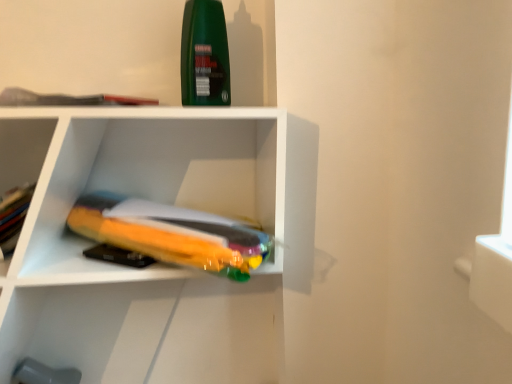
Question: From a real-world perspective, is translucent orange book at center, which appears as the second book when viewed from the top, positioned over matte gray book at upper left, which is the 2th book in bottom-to-top order, based on gravity?

Choices:
 (A) no
 (B) yes

Answer: (A)

Question: Is translucent orange book at center, marked as the first book in a bottom-to-top arrangement, in contact with matte gray book at upper left, which is the 2th book in bottom-to-top order?

Choices:
 (A) no
 (B) yes

Answer: (A)

Question: Is there a large distance between translucent orange book at center, marked as the first book in a bottom-to-top arrangement, and matte gray book at upper left, arranged as the 1th book when viewed from the top?

Choices:
 (A) yes
 (B) no

Answer: (B)

Question: From a real-world perspective, is translucent orange book at center, which appears as the second book when viewed from the top, beneath matte gray book at upper left, which is the 2th book in bottom-to-top order?

Choices:
 (A) yes
 (B) no

Answer: (A)

Question: Considering the relative sizes of translucent orange book at center, which appears as the second book when viewed from the top, and matte gray book at upper left, which is the 2th book in bottom-to-top order, in the image provided, is translucent orange book at center, which appears as the second book when viewed from the top, bigger than matte gray book at upper left, which is the 2th book in bottom-to-top order,?

Choices:
 (A) no
 (B) yes

Answer: (B)

Question: Considering their positions, is green matte bottle at upper center located in front of or behind matte gray book at upper left, arranged as the 1th book when viewed from the top?

Choices:
 (A) front
 (B) behind

Answer: (B)

Question: Based on their positions, is green matte bottle at upper center located to the left or right of matte gray book at upper left, which is the 2th book in bottom-to-top order?

Choices:
 (A) left
 (B) right

Answer: (B)

Question: In terms of height, does green matte bottle at upper center look taller or shorter compared to matte gray book at upper left, arranged as the 1th book when viewed from the top?

Choices:
 (A) short
 (B) tall

Answer: (B)

Question: From the image's perspective, relative to matte gray book at upper left, arranged as the 1th book when viewed from the top, is green matte bottle at upper center above or below?

Choices:
 (A) above
 (B) below

Answer: (A)

Question: Does point tap(150, 102) appear closer or farther from the camera than point tap(39, 125)?

Choices:
 (A) farther
 (B) closer

Answer: (B)

Question: Would you say matte gray book at upper left, which is the 2th book in bottom-to-top order, is to the left or to the right of translucent plastic bag at center in the picture?

Choices:
 (A) left
 (B) right

Answer: (B)

Question: Relative to translucent plastic bag at center, is matte gray book at upper left, arranged as the 1th book when viewed from the top, in front or behind?

Choices:
 (A) front
 (B) behind

Answer: (A)

Question: From their relative heights in the image, would you say matte gray book at upper left, which is the 2th book in bottom-to-top order, is taller or shorter than translucent plastic bag at center?

Choices:
 (A) tall
 (B) short

Answer: (B)

Question: Considering the positions of point (216, 19) and point (96, 233), is point (216, 19) closer or farther from the camera than point (96, 233)?

Choices:
 (A) farther
 (B) closer

Answer: (B)

Question: Is green matte bottle at upper center bigger or smaller than translucent orange book at center, marked as the first book in a bottom-to-top arrangement?

Choices:
 (A) small
 (B) big

Answer: (A)